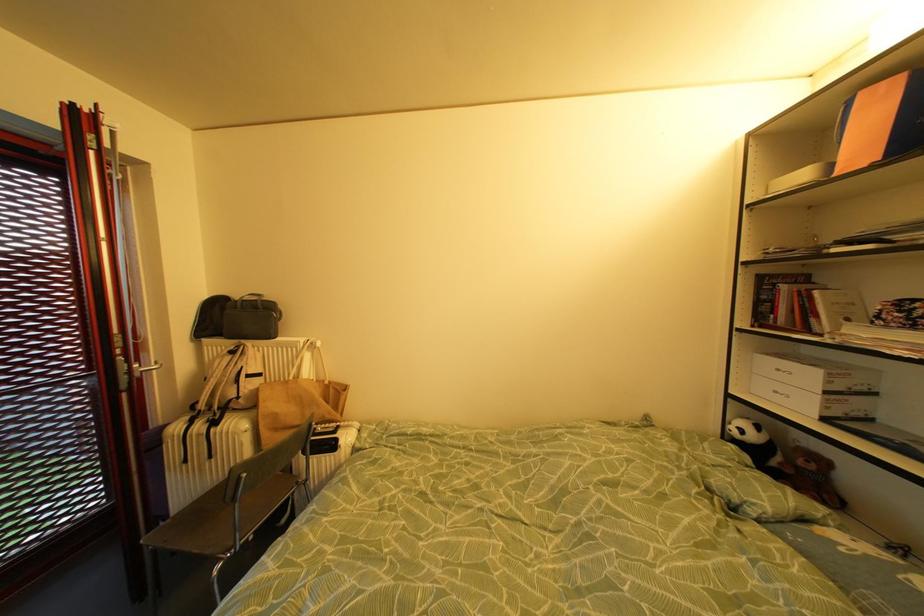
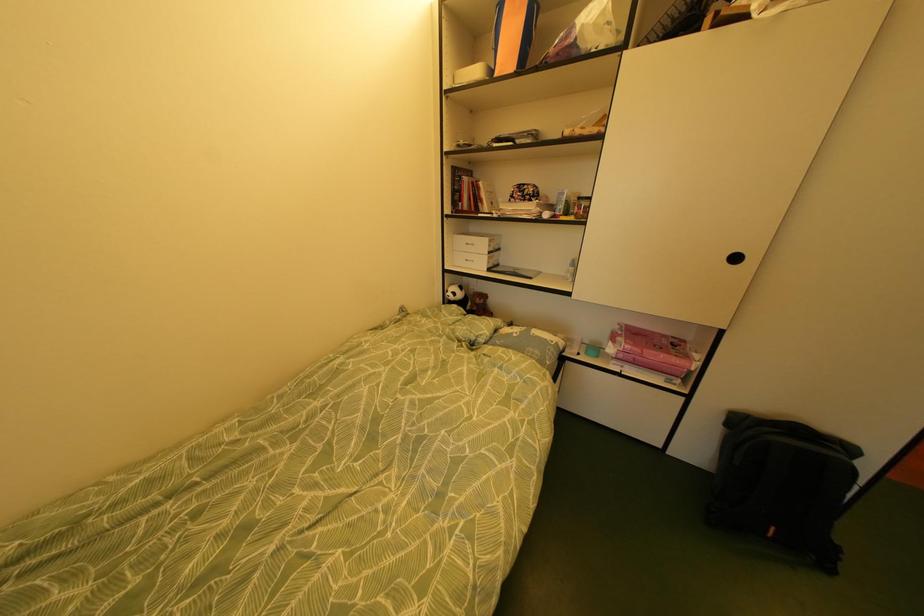
The images are taken continuously from a first-person perspective. In which direction is your viewpoint rotating?

The rotation direction of the camera is right-down.